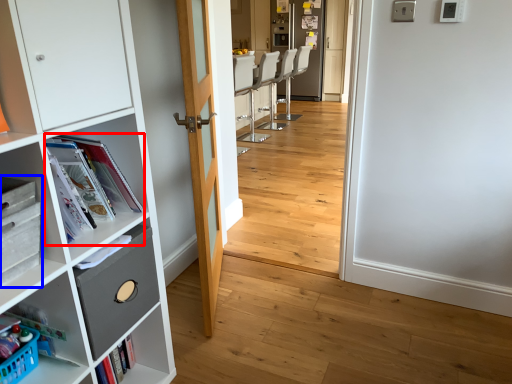
Question: Which point is closer to the camera, magazine (highlighted by a red box) or cabinetry (highlighted by a blue box)?

Choices:
 (A) magazine
 (B) cabinetry

Answer: (B)